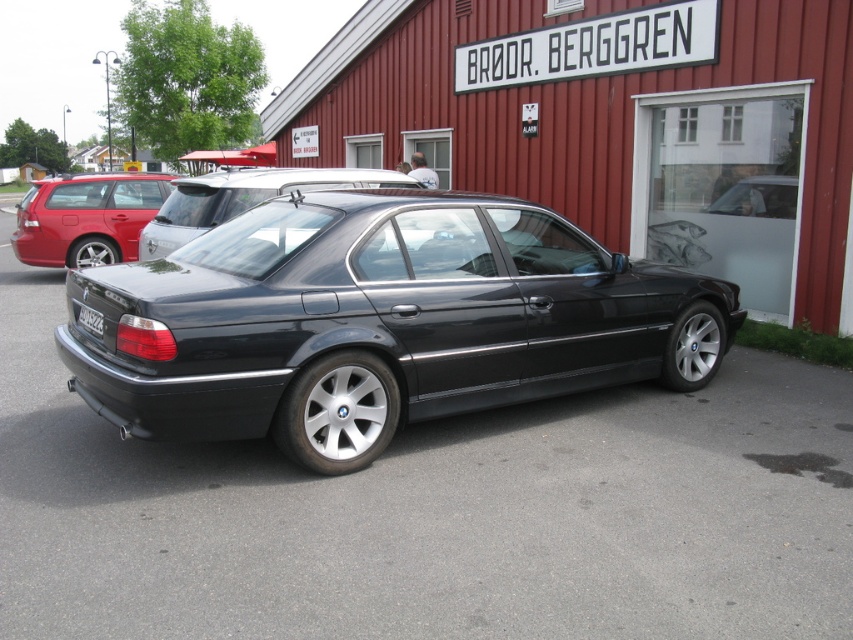
Question: Is glossy black car at center bigger than matte black station wagon at left?

Choices:
 (A) yes
 (B) no

Answer: (A)

Question: Which point is farther from the camera taking this photo?

Choices:
 (A) (149, 243)
 (B) (86, 312)
 (C) (241, 394)
 (D) (105, 196)

Answer: (D)

Question: Considering the real-world distances, which object is farthest from the satin black car at center?

Choices:
 (A) glossy black car at center
 (B) matte black station wagon at left
 (C) black plastic license plate at rear

Answer: (B)

Question: Does matte black station wagon at left appear on the left side of satin black car at center?

Choices:
 (A) no
 (B) yes

Answer: (B)

Question: Which point is farther from the camera taking this photo?

Choices:
 (A) (96, 332)
 (B) (276, 170)

Answer: (B)

Question: Where is matte black station wagon at left located in relation to black plastic license plate at rear in the image?

Choices:
 (A) above
 (B) below

Answer: (A)